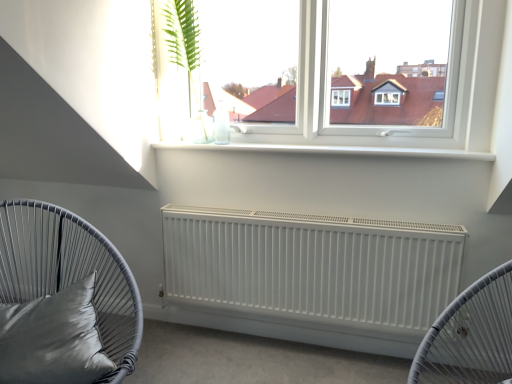
Locate an element on the screen. This screenshot has width=512, height=384. blank area beneath white matte radiator at center (from a real-world perspective) is located at coordinates (305, 336).